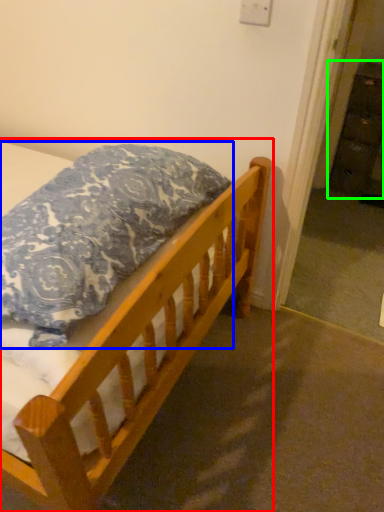
Question: Which object is the farthest from bed (highlighted by a red box)? Choose among these: pillow (highlighted by a blue box) or dresser (highlighted by a green box).

Choices:
 (A) pillow
 (B) dresser

Answer: (B)